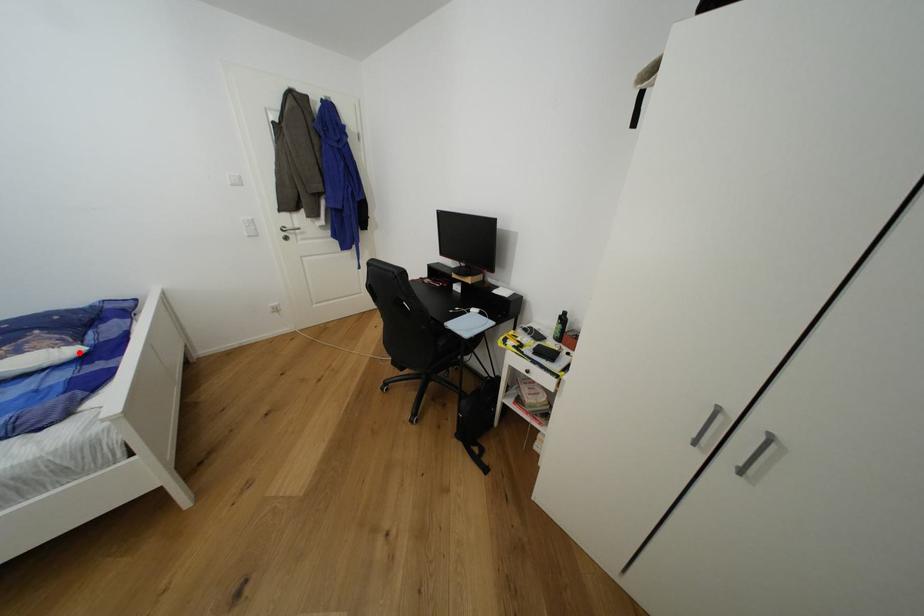
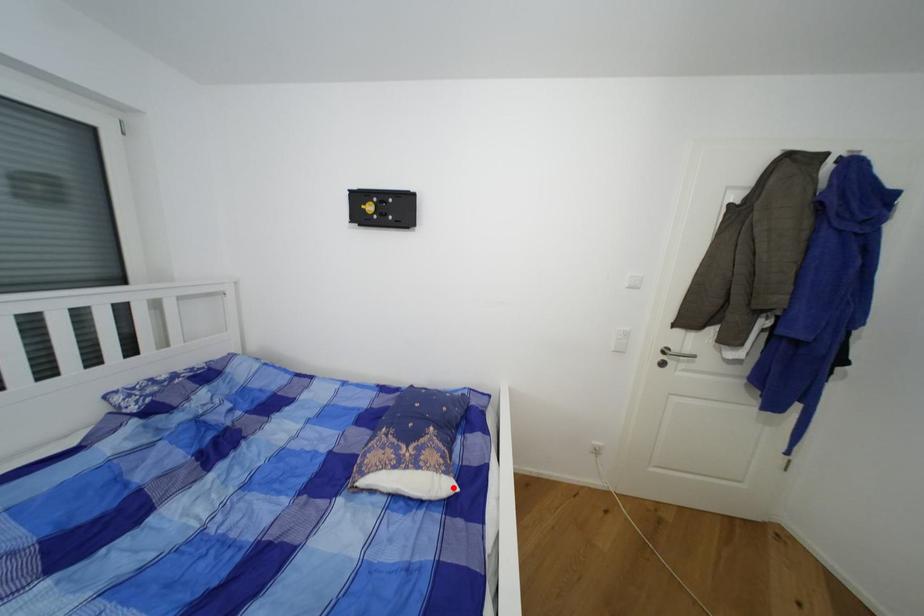
I am providing you with two images of the same scene from different viewpoints. A red point is marked on the first image and another point is marked on the second image. Are the points marked in image1 and image2 representing the same 3D position?

Yes